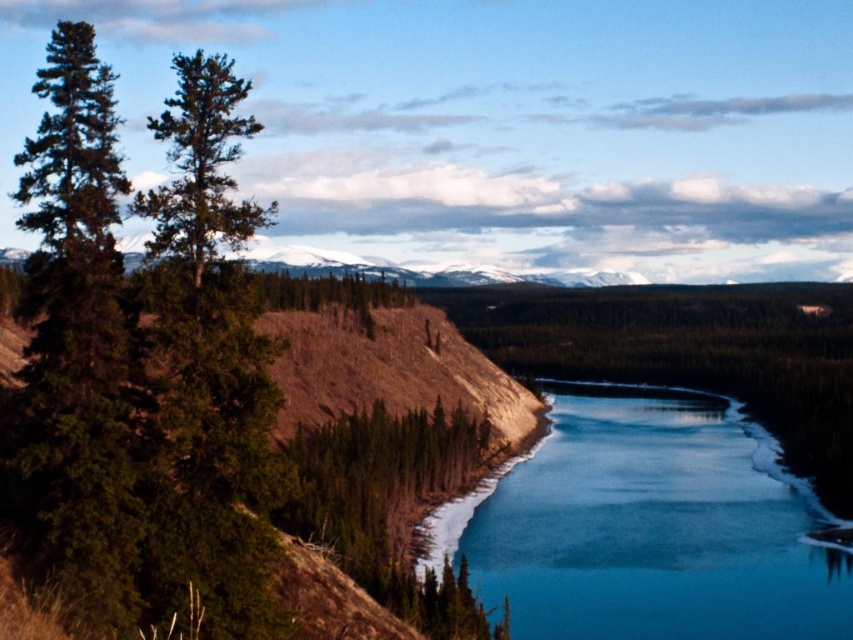
Can you confirm if blue ice at center is positioned above green matte tree at upper left?

No, blue ice at center is not above green matte tree at upper left.

Is blue ice at center to the left of green matte tree at upper left from the viewer's perspective?

No, blue ice at center is not to the left of green matte tree at upper left.

You are a GUI agent. You are given a task and a screenshot of the screen. Output one action in this format:
    pyautogui.click(x=<x>, y=<y>)
    Task: Click on the blue ice at center
    The height and width of the screenshot is (640, 853).
    Given the screenshot: What is the action you would take?
    pos(647,525)